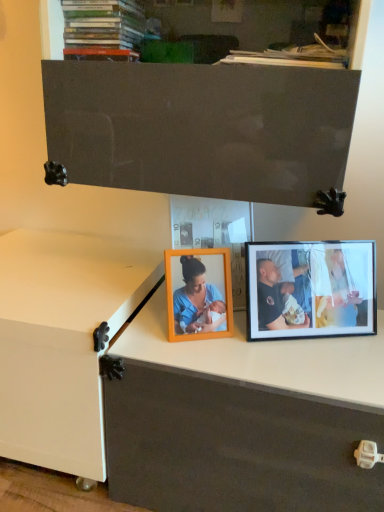
Question: Do you think black matte photo frame at right is within white glossy changing table at lower left, or outside of it?

Choices:
 (A) inside
 (B) outside

Answer: (B)

Question: From a real-world perspective, is black matte photo frame at right physically located above or below white glossy changing table at lower left?

Choices:
 (A) below
 (B) above

Answer: (B)

Question: Considering the positions of black matte photo frame at right and white glossy changing table at lower left in the image, is black matte photo frame at right taller or shorter than white glossy changing table at lower left?

Choices:
 (A) tall
 (B) short

Answer: (B)

Question: Is white glossy changing table at lower left in front of or behind black matte photo frame at right in the image?

Choices:
 (A) front
 (B) behind

Answer: (A)

Question: In terms of height, does white glossy changing table at lower left look taller or shorter compared to black matte photo frame at right?

Choices:
 (A) tall
 (B) short

Answer: (A)

Question: From a real-world perspective, relative to black matte photo frame at right, is white glossy changing table at lower left vertically above or below?

Choices:
 (A) below
 (B) above

Answer: (A)

Question: In terms of width, does white glossy changing table at lower left look wider or thinner when compared to black matte photo frame at right?

Choices:
 (A) wide
 (B) thin

Answer: (A)